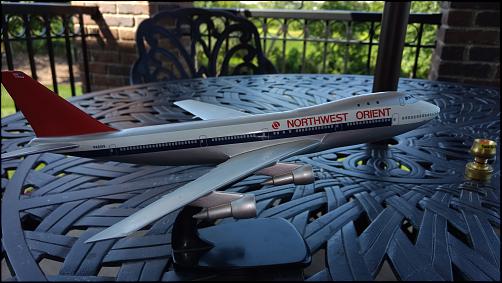
Locate an element on the screen. thin black rectangular photograph border is located at coordinates (500, 142), (237, 1), (0, 158), (235, 282).